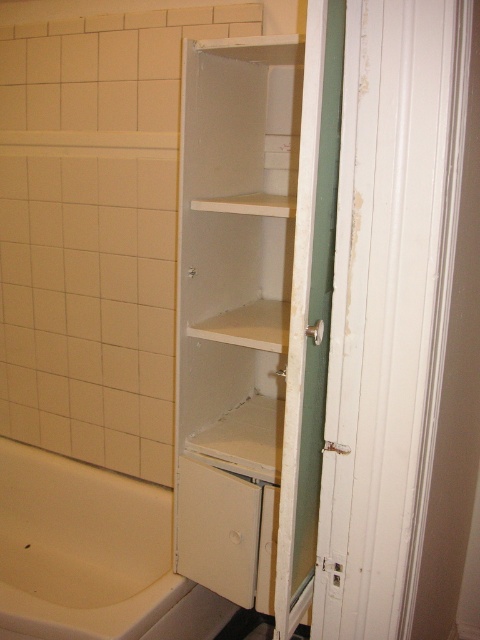
Between white glossy bathtub at lower left and white matte shelf at center, which one is positioned lower?

white glossy bathtub at lower left

Is point (111, 545) closer to viewer compared to point (216, 337)?

No.

Which is behind, point (103, 600) or point (274, 336)?

Positioned behind is point (103, 600).

Locate an element on the screen. white glossy bathtub at lower left is located at coordinates (82, 548).

Find the location of a particular element. white painted wood screen door at right is located at coordinates click(402, 324).

Can you confirm if white painted wood screen door at right is positioned to the right of white matte cabinet at center?

Correct, you'll find white painted wood screen door at right to the right of white matte cabinet at center.

Between point (372, 556) and point (261, 468), which one is positioned behind?

The point (261, 468) is more distant.

Identify the location of white painted wood screen door at right. The height and width of the screenshot is (640, 480). (402, 324).

Does point (280, 212) come behind point (263, 317)?

No, it is not.

Where is `white matte cabinet at center`? The height and width of the screenshot is (640, 480). white matte cabinet at center is located at coordinates (233, 307).